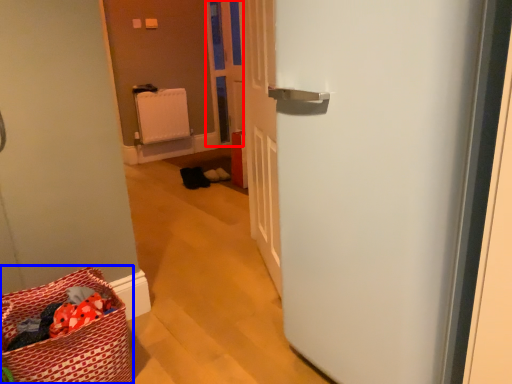
Question: Which point is further to the camera, screen door (highlighted by a red box) or laundry basket (highlighted by a blue box)?

Choices:
 (A) screen door
 (B) laundry basket

Answer: (A)